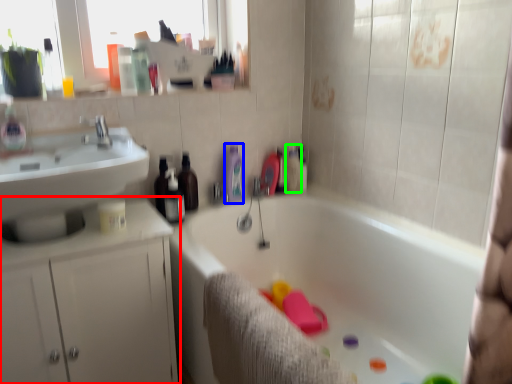
Question: Which object is the farthest from bathroom cabinet (highlighted by a red box)? Choose among these: toiletry (highlighted by a blue box) or toiletry (highlighted by a green box).

Choices:
 (A) toiletry
 (B) toiletry

Answer: (B)